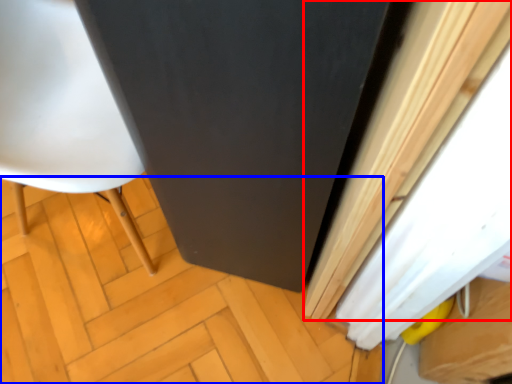
Question: Which object appears closest to the camera in this image, curtain (highlighted by a red box) or plywood (highlighted by a blue box)?

Choices:
 (A) curtain
 (B) plywood

Answer: (A)